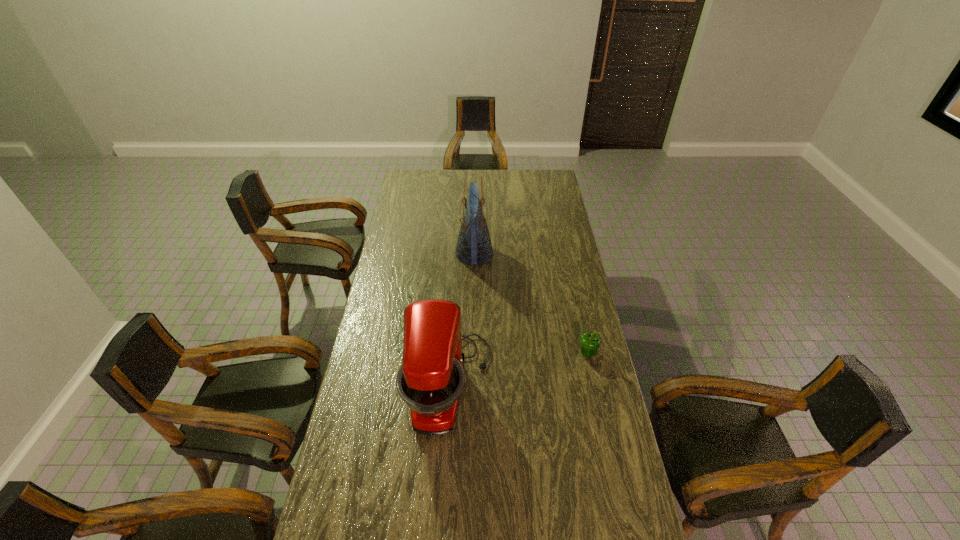
This screenshot has height=540, width=960. Find the location of `shopping bag`. shopping bag is located at coordinates (474, 246).

This screenshot has width=960, height=540. I want to click on kitchen mixer, so pos(430,381).

At what (x,y) coordinates should I click in order to perform the action: click on the shortest object. Please return your answer as a coordinate pair (x, y). The image size is (960, 540). Looking at the image, I should click on (589, 342).

What are the coordinates of `bell pepper` in the screenshot? It's located at (589, 342).

Locate an element on the screen. The height and width of the screenshot is (540, 960). free space located 0.380m on the right of the farthest object is located at coordinates (572, 253).

At what (x,y) coordinates should I click in order to perform the action: click on vacant space located 0.130m on the front-facing side of the kitchen mixer. Please return your answer as a coordinate pair (x, y). The image size is (960, 540). Looking at the image, I should click on (529, 386).

Identify the location of free space located 0.310m on the left of the rightmost object. This screenshot has height=540, width=960. (496, 353).

At what (x,y) coordinates should I click in order to perform the action: click on object present at the right edge. Please return your answer as a coordinate pair (x, y). This screenshot has height=540, width=960. Looking at the image, I should click on (589, 342).

Locate an element on the screen. The height and width of the screenshot is (540, 960). free location at the far edge of the desktop is located at coordinates (523, 171).

You are a GUI agent. You are given a task and a screenshot of the screen. Output one action in this format:
    pyautogui.click(x=<x>, y=<y>)
    Task: Click on the vacant space at the left edge of the desktop
    
    Given the screenshot: What is the action you would take?
    pyautogui.click(x=420, y=193)